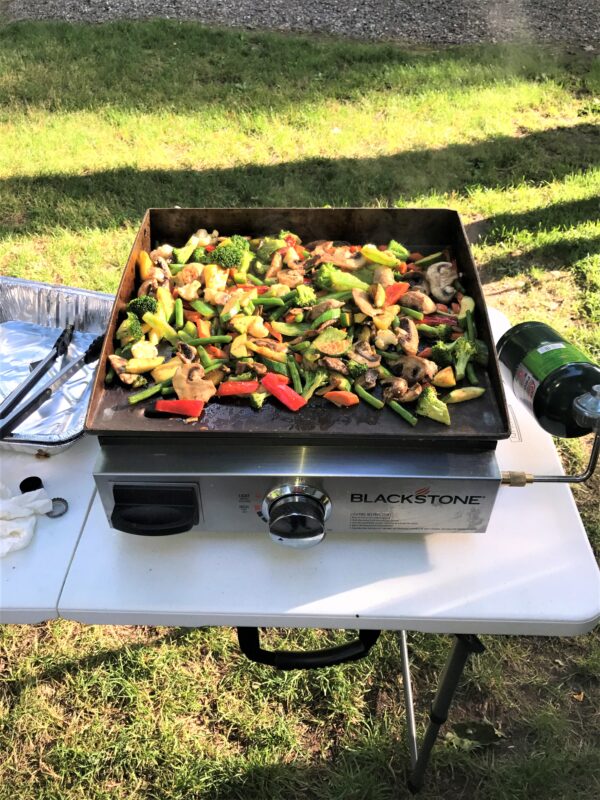
You are a GUI agent. You are given a task and a screenshot of the screen. Output one action in this format:
    pyautogui.click(x=<x>, y=<y>)
    Task: Click on the table leg
    
    Given the screenshot: What is the action you would take?
    pyautogui.click(x=429, y=733)